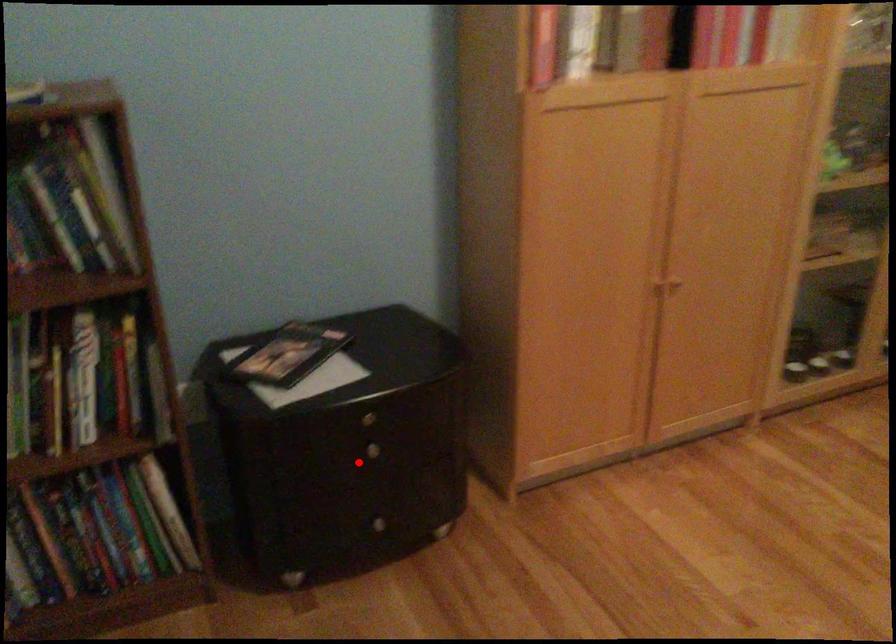
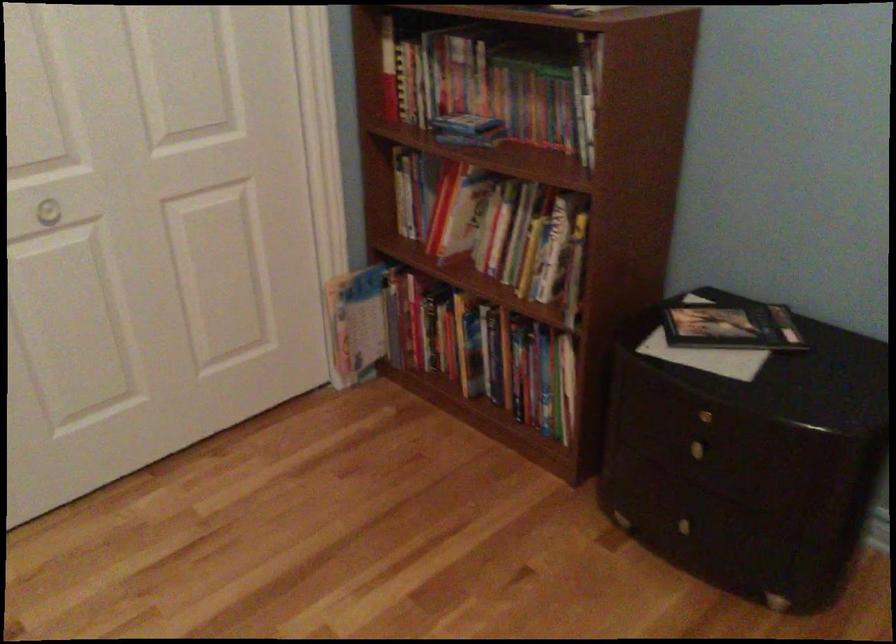
In the second image, find the point that corresponds to the highlighted location in the first image.

(686, 450)